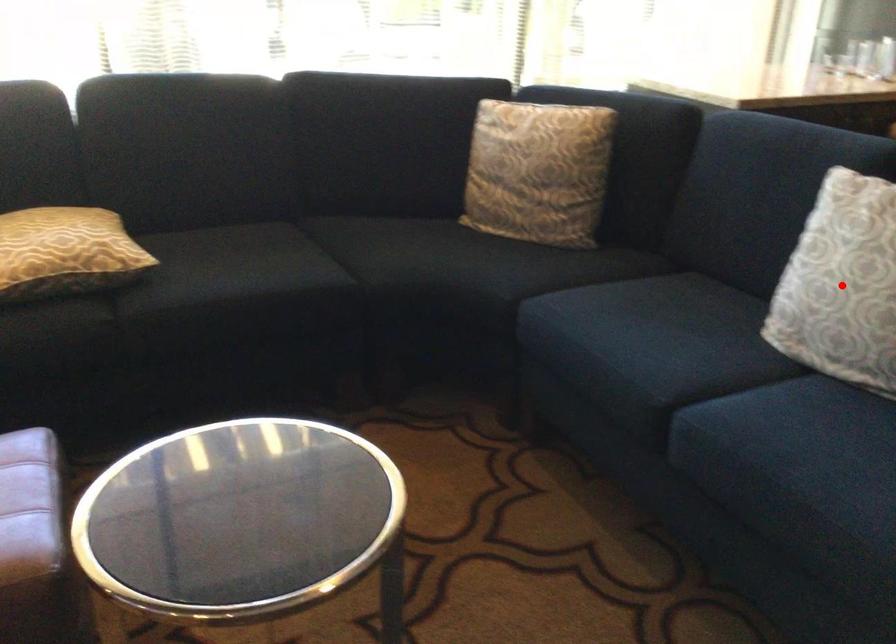
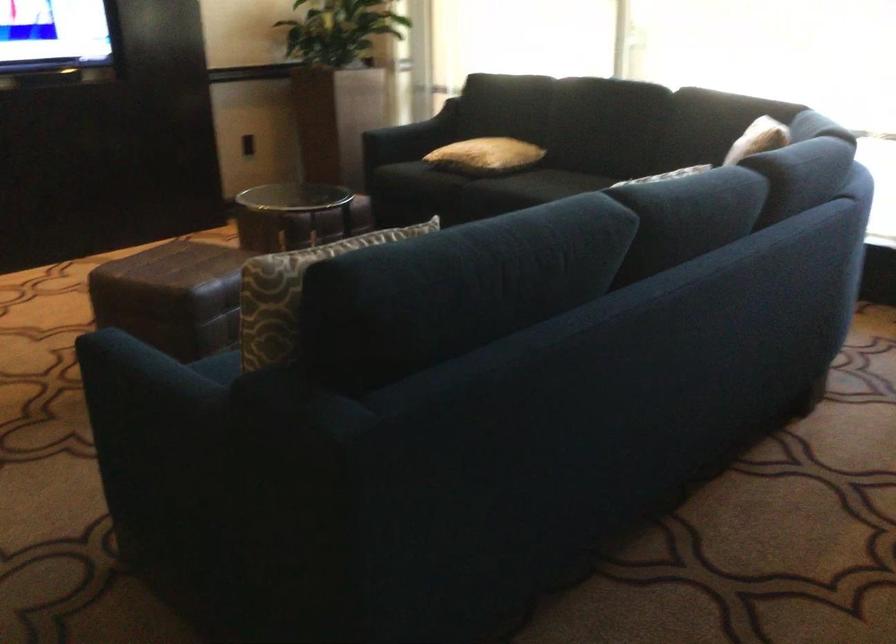
Question: I am providing you with two images of the same scene from different viewpoints. A red point is marked on the first image. Is the red point's position out of view in image 2?

Choices:
 (A) Yes
 (B) No

Answer: (A)